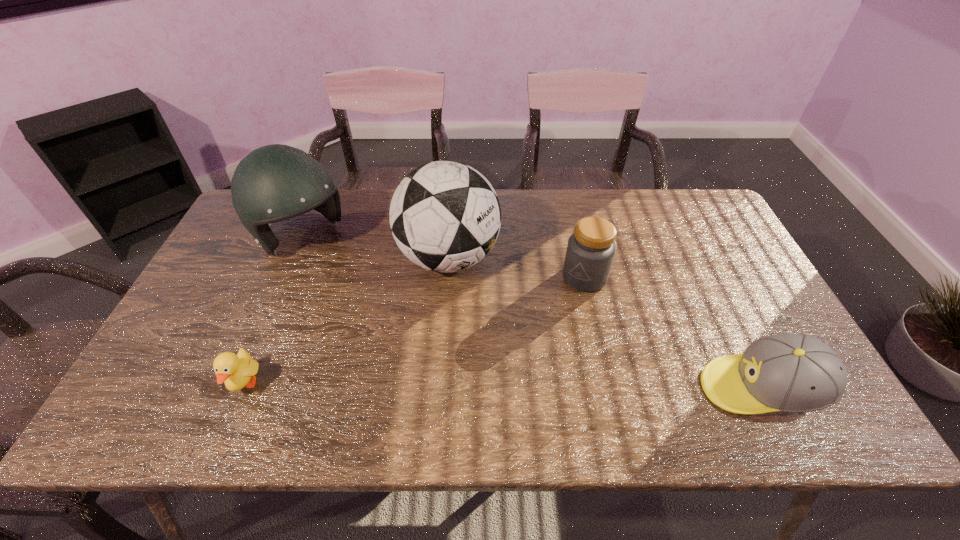
Identify the location of free space on the desktop that is between the shortest object and the baseball cap and is positioned at the face opening of the football helmet. The width and height of the screenshot is (960, 540). (448, 386).

You are a GUI agent. You are given a task and a screenshot of the screen. Output one action in this format:
    pyautogui.click(x=<x>, y=<y>)
    Task: Click on the vacant space on the desktop that is between the duckling and the fourth tallest object and is positioned on the surface of the jar near the warning symbol
    
    Given the screenshot: What is the action you would take?
    pyautogui.click(x=486, y=386)

Identify the location of vacant space on the desktop that is between the duckling and the second shortest object and is positioned on the surface of the third object from left to right where the brand logo is visible. This screenshot has height=540, width=960. (513, 387).